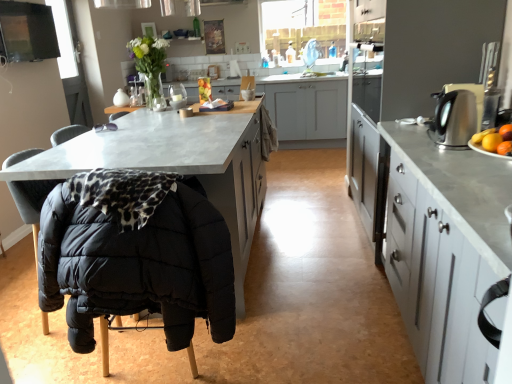
Locate an element on the screen. The width and height of the screenshot is (512, 384). free space to the left of black quilted fabric folding chair at lower left is located at coordinates (51, 355).